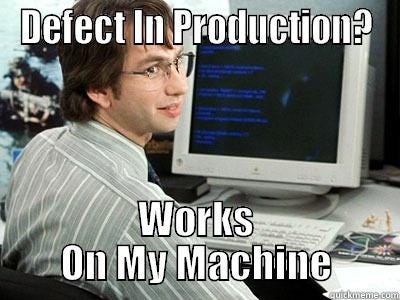
Locate an element on the screen. office space is located at coordinates (372, 192).